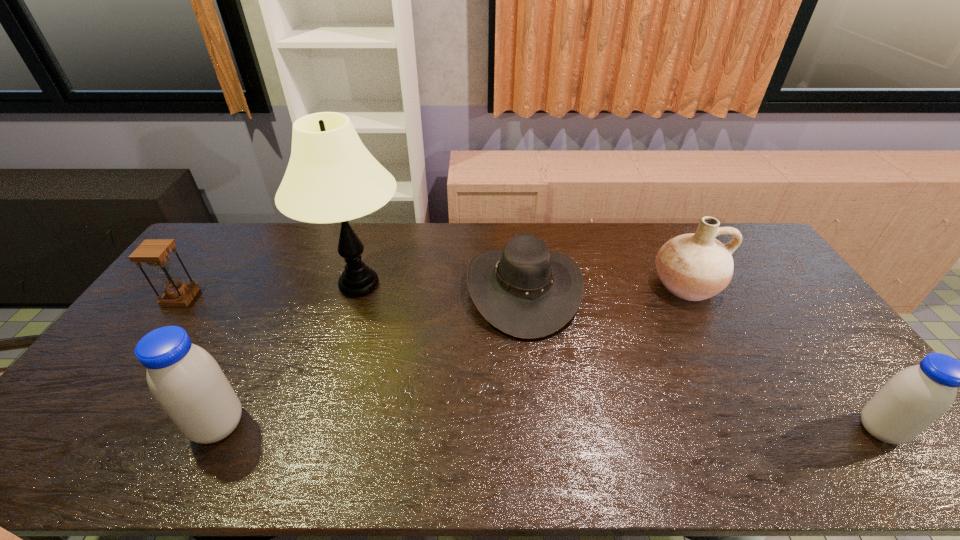
Find the location of `free spot between the fifth object from right to left and the lamp`. free spot between the fifth object from right to left and the lamp is located at coordinates (289, 355).

The image size is (960, 540). Find the location of `free space that is in between the pottery and the fifth object from right to left`. free space that is in between the pottery and the fifth object from right to left is located at coordinates (452, 355).

Identify the location of free space between the taller soya milk and the cowboy hat. Image resolution: width=960 pixels, height=540 pixels. (371, 357).

The width and height of the screenshot is (960, 540). What are the coordinates of `free spot between the shortest object and the fifth object from left to right` in the screenshot? It's located at (605, 287).

Where is `unoccupied position between the second object from right to left and the leftmost object`? unoccupied position between the second object from right to left and the leftmost object is located at coordinates (433, 292).

Find the location of a particular element. This screenshot has height=540, width=960. the second closest object relative to the fourth object from right to left is located at coordinates (186, 381).

Point out which object is positioned as the second nearest to the shorter soya milk. Please provide its 2D coordinates. Your answer should be formatted as a tuple, i.e. [(x, y)], where the tuple contains the x and y coordinates of a point satisfying the conditions above.

[(525, 290)]

What are the coordinates of `free location that satisfies the following two spatial constraints: 1. on the back side of the shorter soya milk; 2. on the front-facing side of the fourth object from left to right` in the screenshot? It's located at (776, 289).

This screenshot has width=960, height=540. Find the location of `free space that satisfies the following two spatial constraints: 1. to pour from the handle of the second object from right to left; 2. on the right side of the shorter soya milk`. free space that satisfies the following two spatial constraints: 1. to pour from the handle of the second object from right to left; 2. on the right side of the shorter soya milk is located at coordinates (761, 430).

I want to click on vacant area in the image that satisfies the following two spatial constraints: 1. to pour from the handle of the pottery; 2. on the front-facing side of the shortest object, so click(687, 289).